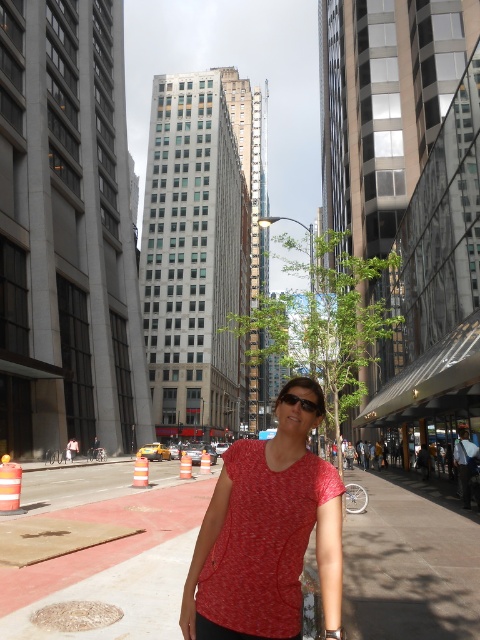
Question: Which is nearer to the red matte shirt at center?

Choices:
 (A) smooth concrete sidewalk at center
 (B) matte black sunglasses at center

Answer: (B)

Question: Is smooth concrete sidewalk at center to the left of green leafy tree at center from the viewer's perspective?

Choices:
 (A) yes
 (B) no

Answer: (A)

Question: Which of these objects is positioned farthest from the matte black sunglasses at center?

Choices:
 (A) green leafy tree at center
 (B) smooth concrete sidewalk at center

Answer: (A)

Question: Does smooth concrete sidewalk at center have a lesser width compared to matte black sunglasses at center?

Choices:
 (A) no
 (B) yes

Answer: (A)

Question: Observing the image, what is the correct spatial positioning of red matte shirt at center in reference to green leafy tree at center?

Choices:
 (A) below
 (B) above

Answer: (A)

Question: Which object is farther from the camera taking this photo?

Choices:
 (A) smooth concrete sidewalk at center
 (B) red matte shirt at center

Answer: (A)